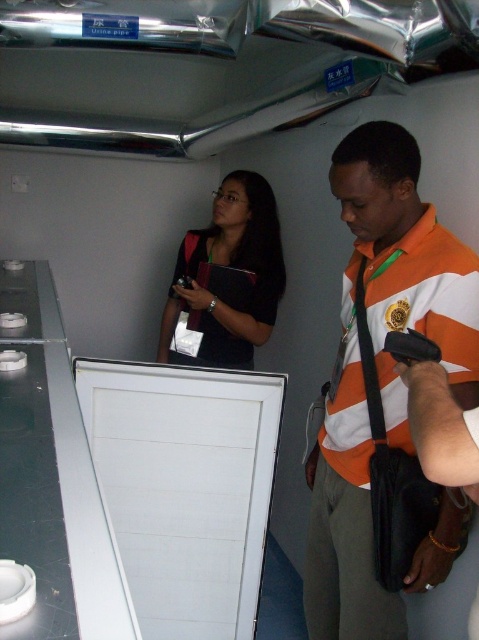
Question: Which point appears farthest from the camera in this image?

Choices:
 (A) (332, 483)
 (B) (250, 316)

Answer: (B)

Question: Where is orange striped shirt at center located in relation to black matte laptop at upper center in the image?

Choices:
 (A) left
 (B) right

Answer: (B)

Question: Does orange striped shirt at center appear over black matte laptop at upper center?

Choices:
 (A) yes
 (B) no

Answer: (B)

Question: Is orange striped shirt at center thinner than black matte laptop at upper center?

Choices:
 (A) no
 (B) yes

Answer: (B)